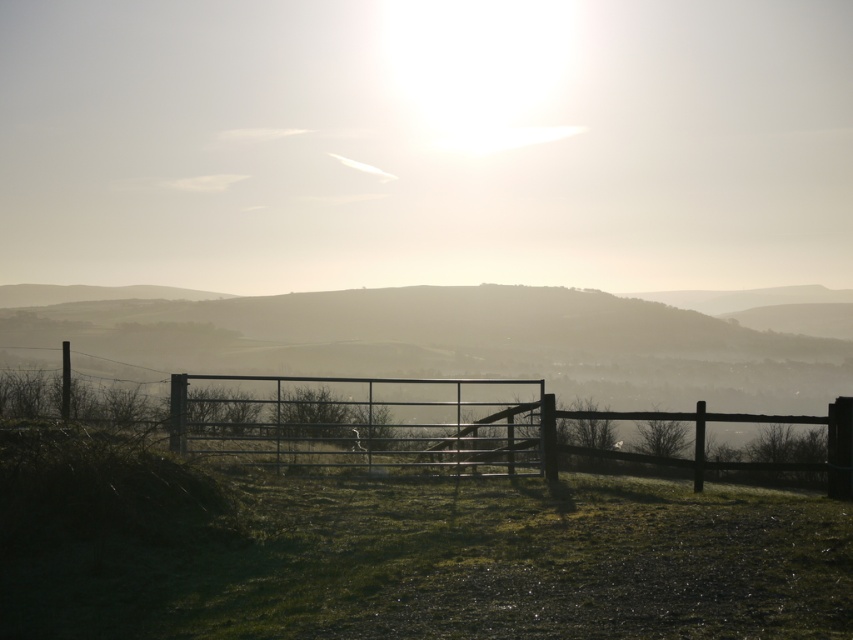
Who is positioned more to the left, green grassy at center or metallic gate at center?

Positioned to the left is metallic gate at center.

Does green grassy at center have a larger size compared to metallic gate at center?

Incorrect, green grassy at center is not larger than metallic gate at center.

Which is behind, point (422, 605) or point (489, 408)?

Point (489, 408)

Identify the location of green grassy at center. (401, 554).